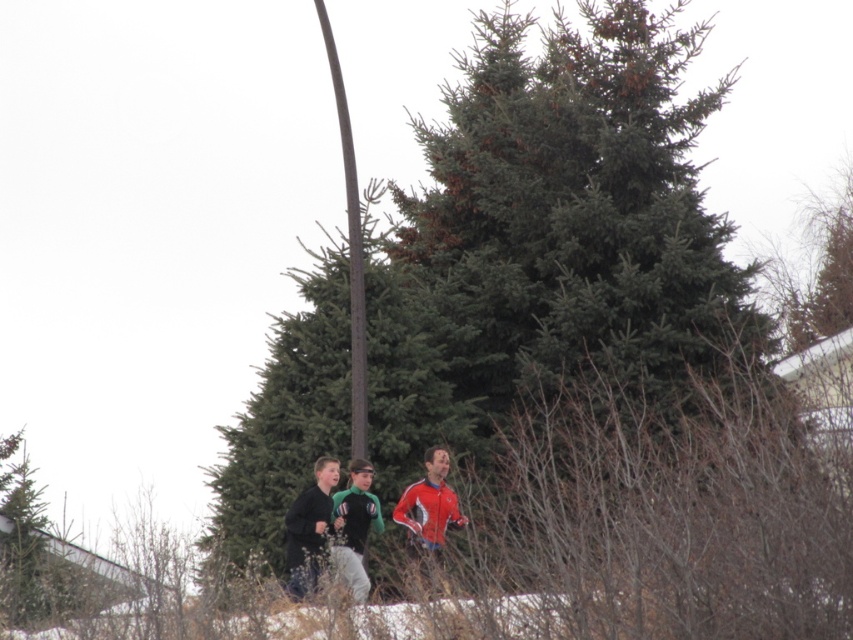
Looking at this image, can you confirm if red and white synthetic jacket at center is thinner than dark gray fleece jacket at lower center?

Incorrect, red and white synthetic jacket at center's width is not less than dark gray fleece jacket at lower center's.

Image resolution: width=853 pixels, height=640 pixels. What are the coordinates of `red and white synthetic jacket at center` in the screenshot? It's located at (428, 509).

Can you confirm if brown textured pole at center is wider than red and white synthetic jacket at center?

No, brown textured pole at center is not wider than red and white synthetic jacket at center.

Is point (347, 132) closer to viewer compared to point (422, 541)?

No, it is not.

Is point (358, 291) positioned behind point (434, 561)?

That is True.

Find the location of a particular element. The width and height of the screenshot is (853, 640). brown textured pole at center is located at coordinates (350, 248).

Is green matte fir tree at center to the left of brown textured pole at center from the viewer's perspective?

In fact, green matte fir tree at center is to the right of brown textured pole at center.

Between green matte fir tree at center and brown textured pole at center, which one is positioned higher?

green matte fir tree at center is higher up.

Which is in front, point (699, 108) or point (328, 19)?

Point (699, 108) is more forward.

Image resolution: width=853 pixels, height=640 pixels. Identify the location of green matte fir tree at center. (550, 237).